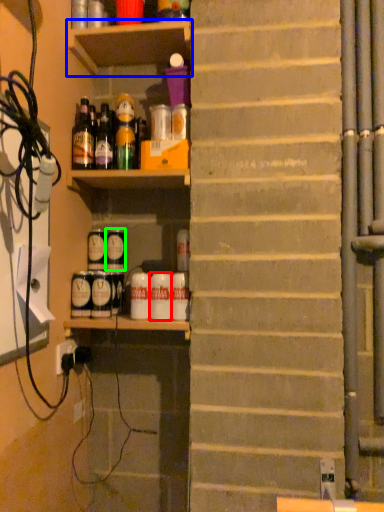
Question: Which object is the closest to the beverage (highlighted by a red box)? Choose among these: shelf (highlighted by a blue box) or beverage (highlighted by a green box).

Choices:
 (A) shelf
 (B) beverage

Answer: (B)